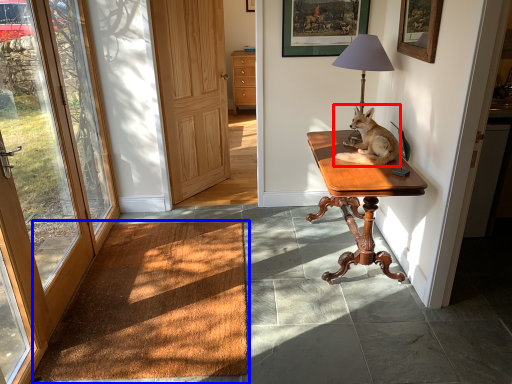
Question: Which point is closer to the camera, dog (highlighted by a red box) or carpeting board (highlighted by a blue box)?

Choices:
 (A) dog
 (B) carpeting board

Answer: (B)